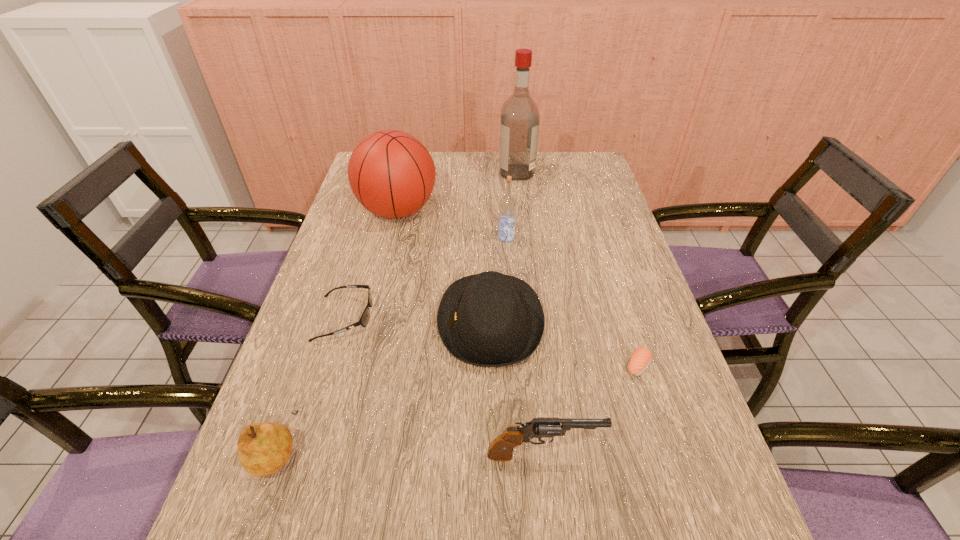
Where is `free space located on the front-facing side of the liquor`? The width and height of the screenshot is (960, 540). free space located on the front-facing side of the liquor is located at coordinates (396, 172).

The height and width of the screenshot is (540, 960). I want to click on free location located on the front-facing side of the liquor, so click(x=417, y=172).

This screenshot has height=540, width=960. Find the location of `free space located 0.390m on the front-facing side of the liquor`. free space located 0.390m on the front-facing side of the liquor is located at coordinates (392, 172).

At what (x,y) coordinates should I click in order to perform the action: click on vacant point located on the front of the basketball. Please return your answer as a coordinate pair (x, y). Looking at the image, I should click on (387, 258).

The image size is (960, 540). What are the coordinates of `vacant space located on the front of the sixth shortest object` in the screenshot? It's located at (513, 329).

The width and height of the screenshot is (960, 540). What are the coordinates of `free location located along the barrel of the gun` in the screenshot? It's located at (705, 455).

Image resolution: width=960 pixels, height=540 pixels. What are the coordinates of `free location located on the front-facing side of the fedora` in the screenshot? It's located at (331, 322).

Identify the location of vacant space positioned on the front-facing side of the fedora. (319, 322).

Find the location of a particular element. Image resolution: width=960 pixels, height=540 pixels. vacant area situated 0.130m on the front-facing side of the fedora is located at coordinates (384, 322).

You are a GUI agent. You are given a task and a screenshot of the screen. Output one action in this format:
    pyautogui.click(x=<x>, y=<y>)
    Task: Click on the free space located on the right of the pear
    The height and width of the screenshot is (540, 960).
    Given the screenshot: What is the action you would take?
    pyautogui.click(x=358, y=450)